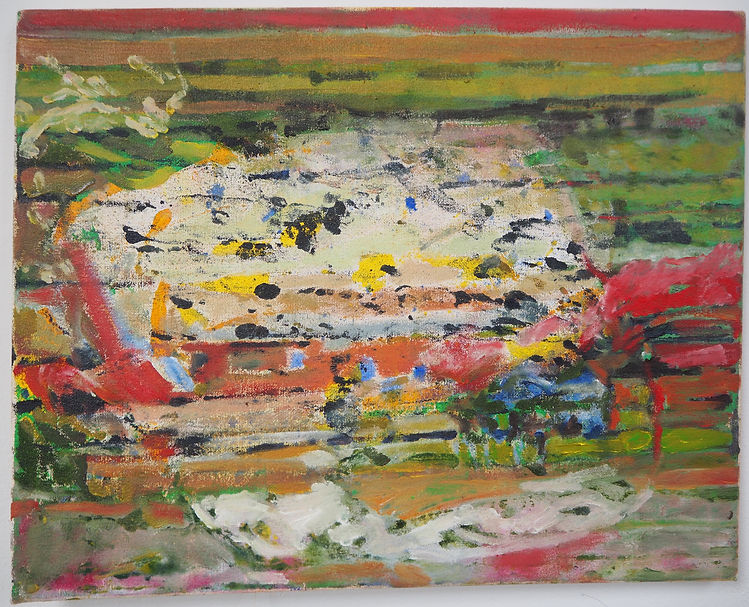
Locate an element on the screen. white paint is located at coordinates (267, 516), (203, 228).